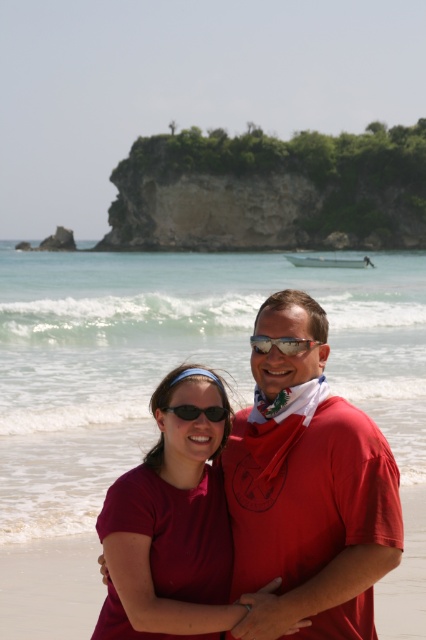
Question: Which object is positioned closest to the matte red shirt at center?

Choices:
 (A) black plastic sunglasses at center
 (B) matte red t-shirt at center

Answer: (B)

Question: Which is farther from the matte red shirt at center?

Choices:
 (A) matte red t-shirt at center
 (B) silver reflective sunglasses at center
 (C) black plastic sunglasses at center

Answer: (B)

Question: Does matte red shirt at center appear on the left side of black plastic sunglasses at center?

Choices:
 (A) yes
 (B) no

Answer: (A)

Question: Is matte red t-shirt at center below black plastic sunglasses at center?

Choices:
 (A) no
 (B) yes

Answer: (B)

Question: Is matte red shirt at center further to camera compared to silver reflective sunglasses at center?

Choices:
 (A) yes
 (B) no

Answer: (B)

Question: Based on their relative distances, which object is farther from the matte red shirt at center?

Choices:
 (A) black plastic sunglasses at center
 (B) silver reflective sunglasses at center
 (C) matte red t-shirt at center

Answer: (B)